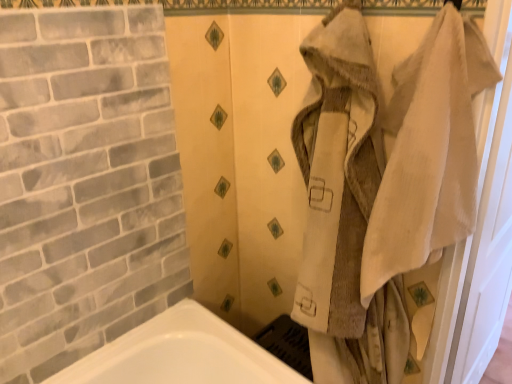
The width and height of the screenshot is (512, 384). Find the location of `beige fabric screen door at right`. beige fabric screen door at right is located at coordinates (488, 216).

The width and height of the screenshot is (512, 384). What do you see at coordinates (488, 216) in the screenshot?
I see `beige fabric screen door at right` at bounding box center [488, 216].

This screenshot has width=512, height=384. What are the coordinates of `white textured towel at right` in the screenshot? It's located at point(429,152).

The width and height of the screenshot is (512, 384). Describe the element at coordinates (429, 152) in the screenshot. I see `white textured towel at right` at that location.

Where is `beige fabric screen door at right`? beige fabric screen door at right is located at coordinates (488, 216).

Between white textured towel at right and beige fabric screen door at right, which one appears on the right side from the viewer's perspective?

beige fabric screen door at right.

Is white textured towel at right positioned behind beige fabric screen door at right?

That is False.

Which is further, (462, 102) or (510, 278)?

The point (510, 278) is more distant.

From the image's perspective, does white textured towel at right appear lower than beige fabric screen door at right?

No, from the image's perspective, white textured towel at right is not beneath beige fabric screen door at right.

From a real-world perspective, relative to beige fabric screen door at right, is white textured towel at right vertically above or below?

From a real-world perspective, white textured towel at right is physically above beige fabric screen door at right.

Can you confirm if white textured towel at right is thinner than beige fabric screen door at right?

No.

Considering the sizes of objects white textured towel at right and beige fabric screen door at right in the image provided, who is shorter, white textured towel at right or beige fabric screen door at right?

Standing shorter between the two is white textured towel at right.

Can you confirm if white textured towel at right is smaller than beige fabric screen door at right?

Yes.

Based on the photo, would you say white textured towel at right is inside or outside beige fabric screen door at right?

white textured towel at right cannot be found inside beige fabric screen door at right.

Would you consider white textured towel at right to be distant from beige fabric screen door at right?

white textured towel at right is near beige fabric screen door at right, not far away.

Is white textured towel at right facing towards beige fabric screen door at right?

No.

Find the location of a particular element. This screenshot has height=384, width=512. screen door that appears below the white textured towel at right (from the image's perspective) is located at coordinates (488, 216).

Is beige fabric screen door at right at the left side of white textured towel at right?

In fact, beige fabric screen door at right is to the right of white textured towel at right.

Is the position of beige fabric screen door at right more distant than that of white textured towel at right?

That is True.

Between point (489, 41) and point (380, 255), which one is positioned in front?

Positioned in front is point (489, 41).

From the image's perspective, is beige fabric screen door at right below white textured towel at right?

Indeed, from the image's perspective, beige fabric screen door at right is shown beneath white textured towel at right.

From a real-world perspective, between beige fabric screen door at right and white textured towel at right, who is vertically higher?

white textured towel at right.

Looking at this image, considering the relative sizes of beige fabric screen door at right and white textured towel at right in the image provided, is beige fabric screen door at right thinner than white textured towel at right?

Yes, beige fabric screen door at right is thinner than white textured towel at right.

Which of these two, beige fabric screen door at right or white textured towel at right, stands shorter?

white textured towel at right is shorter.

Which of these two, beige fabric screen door at right or white textured towel at right, is bigger?

beige fabric screen door at right is bigger.

Looking at this image, would you say beige fabric screen door at right is inside or outside white textured towel at right?

beige fabric screen door at right lies outside white textured towel at right.

Is beige fabric screen door at right with white textured towel at right?

No.

Is beige fabric screen door at right positioned with its back to white textured towel at right?

beige fabric screen door at right is not turned away from white textured towel at right.

Can you tell me how much beige fabric screen door at right and white textured towel at right differ in facing direction?

The facing directions of beige fabric screen door at right and white textured towel at right are 92.7 degrees apart.

Image resolution: width=512 pixels, height=384 pixels. In order to click on screen door below the white textured towel at right (from the image's perspective) in this screenshot , I will do `click(488, 216)`.

Find the location of `bath towel above the beige fabric screen door at right (from a real-world perspective)`. bath towel above the beige fabric screen door at right (from a real-world perspective) is located at coordinates (429, 152).

Locate an element on the screen. The image size is (512, 384). screen door on the right of white textured towel at right is located at coordinates (488, 216).